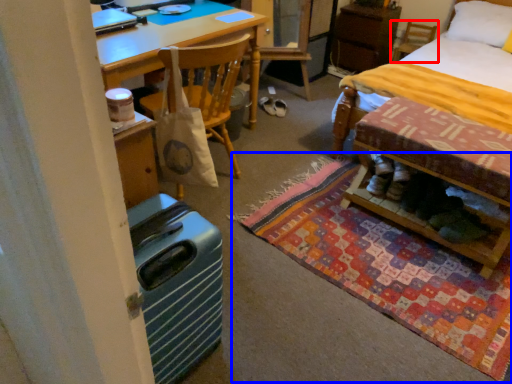
Question: Which point is closer to the camera, chair (highlighted by a red box) or mat (highlighted by a blue box)?

Choices:
 (A) chair
 (B) mat

Answer: (B)